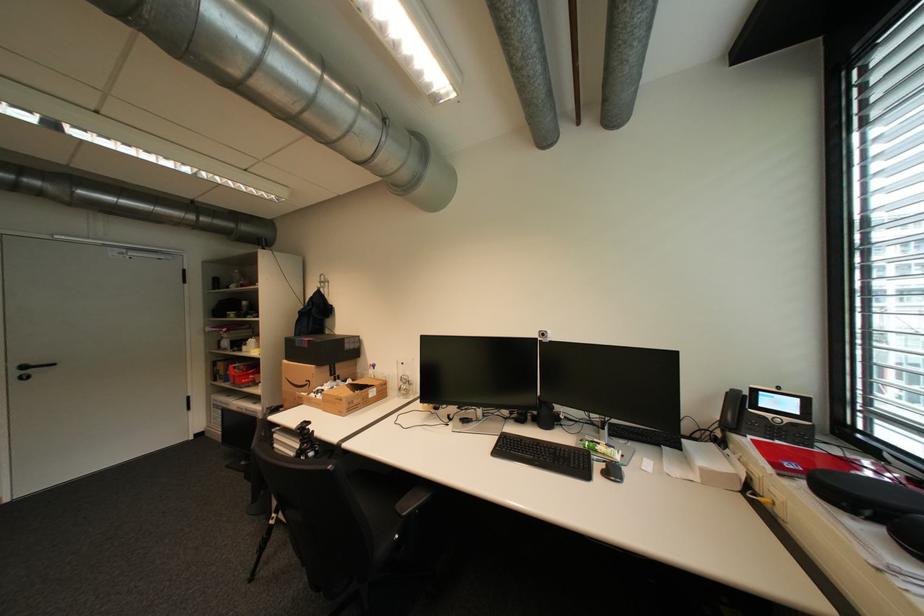
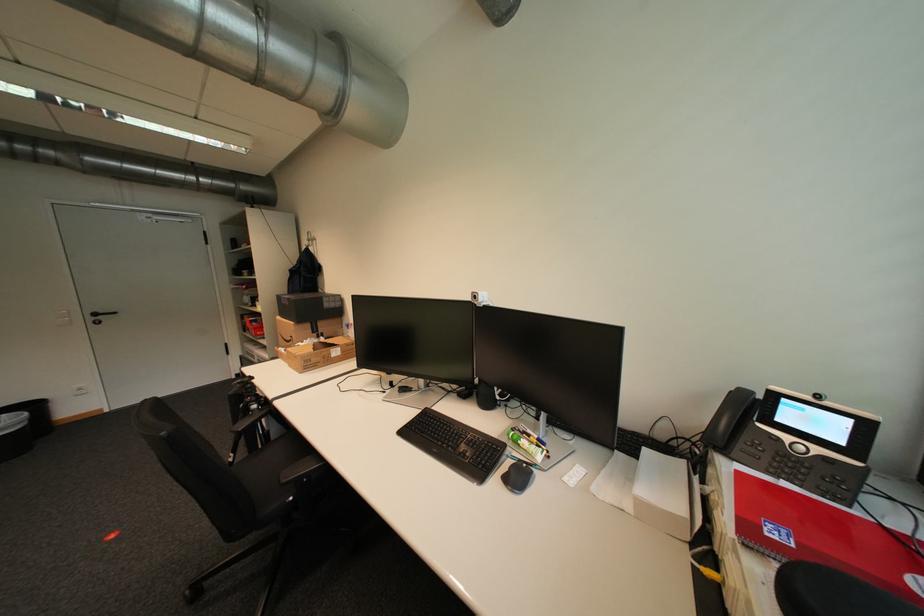
In the second image, find the point that corresponds to point 746,431 in the first image.

(734, 453)